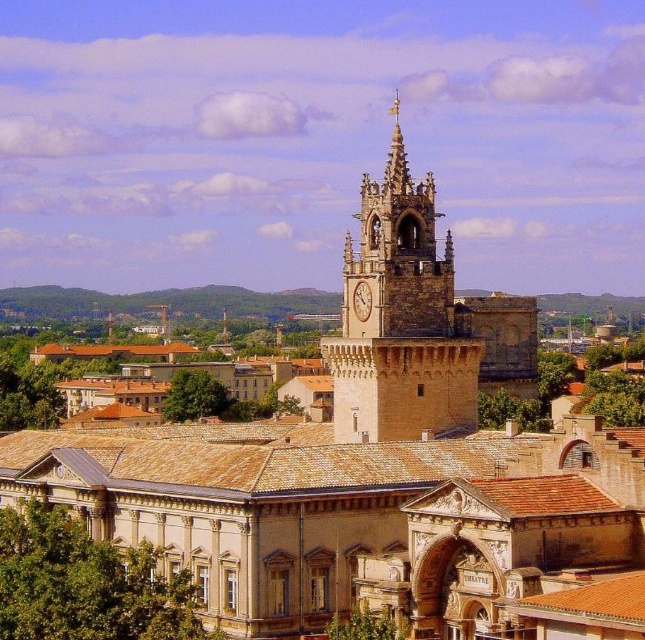
Is stone clock tower at center thinner than gold textured clock at center?

No, stone clock tower at center is not thinner than gold textured clock at center.

In the scene shown: Does stone clock tower at center appear over gold textured clock at center?

Correct, stone clock tower at center is located above gold textured clock at center.

You are a GUI agent. You are given a task and a screenshot of the screen. Output one action in this format:
    pyautogui.click(x=<x>, y=<y>)
    Task: Click on the stone clock tower at center
    This screenshot has width=645, height=640.
    Given the screenshot: What is the action you would take?
    pyautogui.click(x=401, y=320)